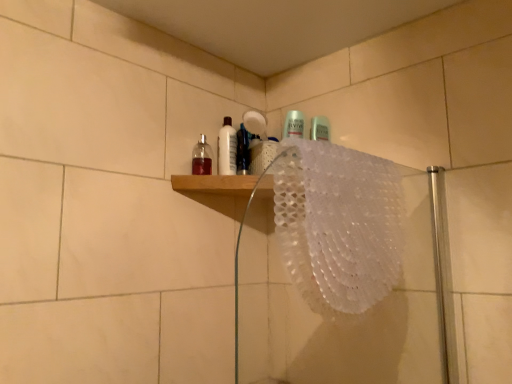
Question: Considering the positions of white textured bath towel at upper right and white glossy bottle at upper center, the 2th mouthwash positioned from the right, in the image, is white textured bath towel at upper right taller or shorter than white glossy bottle at upper center, the 2th mouthwash positioned from the right,?

Choices:
 (A) short
 (B) tall

Answer: (B)

Question: From a real-world perspective, is white textured bath towel at upper right positioned above or below white glossy bottle at upper center, the 2th mouthwash positioned from the right?

Choices:
 (A) above
 (B) below

Answer: (B)

Question: Estimate the real-world distances between objects in this image. Which object is closer to the semi-transparent plastic mouthwash at upper center, which is the first mouthwash from right to left?

Choices:
 (A) white lace doily at upper center
 (B) translucent glass bottle at upper center, positioned as the first mouthwash in left-to-right order
 (C) white textured bath towel at upper right
 (D) white glossy bottle at upper center, the 2th mouthwash positioned from the right

Answer: (D)

Question: Which of these objects is positioned farthest from the white textured bath towel at upper right?

Choices:
 (A) white lace doily at upper center
 (B) white glossy bottle at upper center, the 2th mouthwash when ordered from left to right
 (C) translucent glass bottle at upper center, positioned as the first mouthwash in left-to-right order
 (D) semi-transparent plastic mouthwash at upper center, which is the first mouthwash from right to left

Answer: (C)